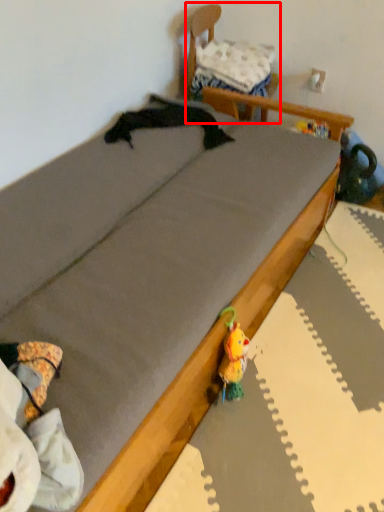
Question: From the image's perspective, where is furniture (annotated by the red box) located relative to pillow?

Choices:
 (A) below
 (B) above

Answer: (A)